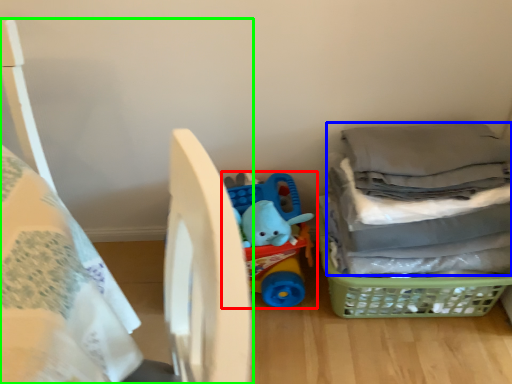
Question: Which object is positioned farthest from toy (highlighted by a red box)? Select from laundry (highlighted by a blue box) and bed (highlighted by a green box).

Choices:
 (A) laundry
 (B) bed

Answer: (B)